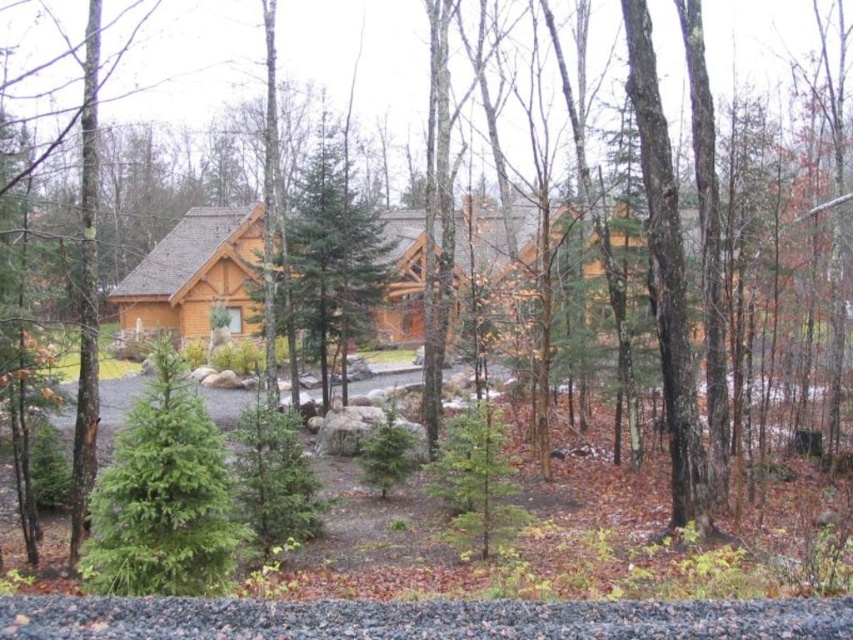
You are planning to build a small garden between the wooden cabin at center and the green evergreen tree at center. Considering their sizes, which one should you place closer to the garden to ensure it doesn

The wooden cabin at center is larger than the green evergreen tree at center, so placing the smaller green evergreen tree at center closer to the garden would leave more space for the cabin and maintain balance.

You are standing in the forest and see the wooden cabin at center and the green textured evergreen tree at center. Which one is taller?

The green textured evergreen tree at center is taller than the wooden cabin at center.

What are the coordinates of the green evergreen tree at center in the image?

The green evergreen tree at center is located at coordinates point [163,497].